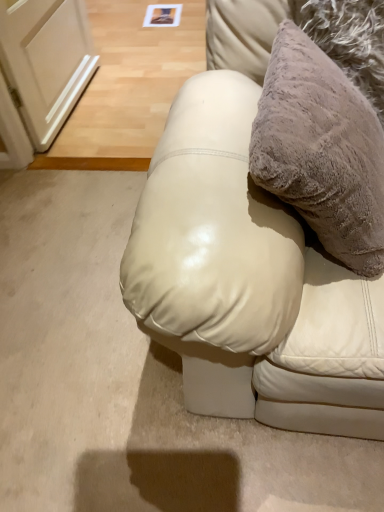
Question: Does leather couch at center appear on the left side of fuzzy beige pillow at upper right?

Choices:
 (A) yes
 (B) no

Answer: (A)

Question: Would you consider leather couch at center to be distant from fuzzy beige pillow at upper right?

Choices:
 (A) no
 (B) yes

Answer: (A)

Question: Is fuzzy beige pillow at upper right at the back of leather couch at center?

Choices:
 (A) no
 (B) yes

Answer: (B)

Question: Is leather couch at center outside fuzzy beige pillow at upper right?

Choices:
 (A) yes
 (B) no

Answer: (A)

Question: Can you confirm if leather couch at center is smaller than fuzzy beige pillow at upper right?

Choices:
 (A) yes
 (B) no

Answer: (B)

Question: Is leather couch at center directly adjacent to fuzzy beige pillow at upper right?

Choices:
 (A) yes
 (B) no

Answer: (B)

Question: Is the depth of fuzzy beige pillow at upper right less than that of leather couch at center?

Choices:
 (A) yes
 (B) no

Answer: (B)

Question: From the image's perspective, does fuzzy beige pillow at upper right appear higher than leather couch at center?

Choices:
 (A) yes
 (B) no

Answer: (A)

Question: From a real-world perspective, is fuzzy beige pillow at upper right located beneath leather couch at center?

Choices:
 (A) yes
 (B) no

Answer: (B)

Question: Is fuzzy beige pillow at upper right completely or partially outside of leather couch at center?

Choices:
 (A) yes
 (B) no

Answer: (B)

Question: Is fuzzy beige pillow at upper right positioned with its back to leather couch at center?

Choices:
 (A) no
 (B) yes

Answer: (B)

Question: Is fuzzy beige pillow at upper right next to leather couch at center and touching it?

Choices:
 (A) no
 (B) yes

Answer: (A)

Question: From the image's perspective, is fuzzy beige pillow at upper right positioned above or below leather couch at center?

Choices:
 (A) above
 (B) below

Answer: (A)